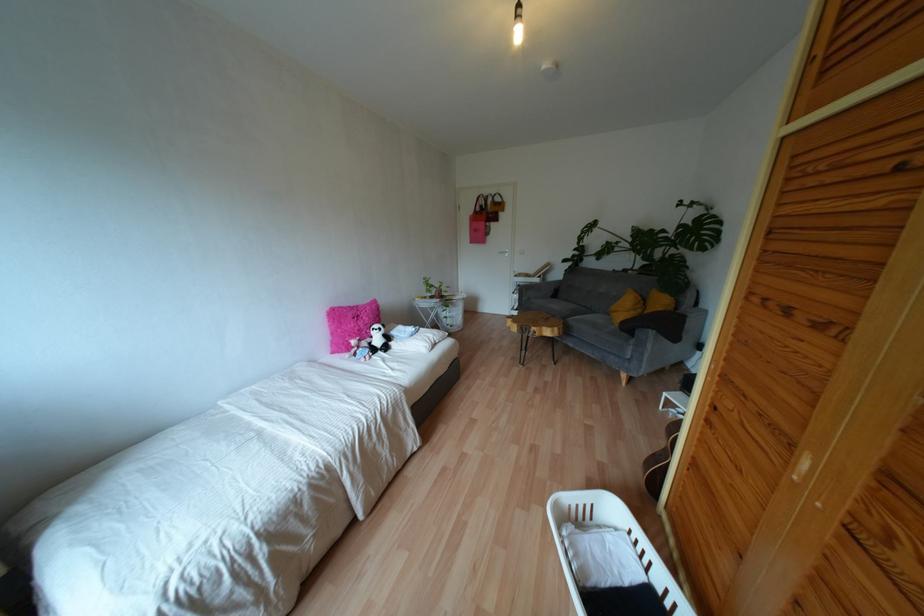
Where would you lift the brown handbag? Please return your answer as a coordinate pair (x, y).

(478, 221)